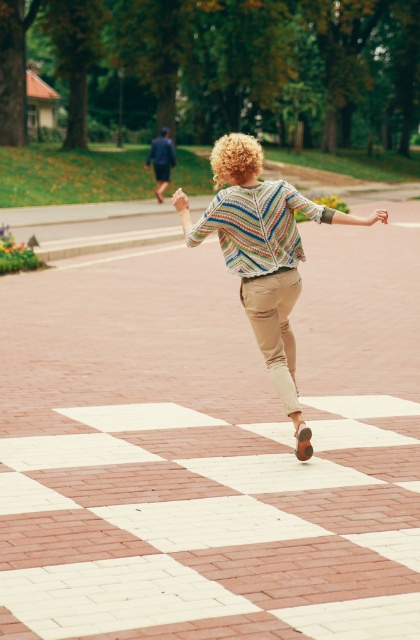
You are standing in the park and see the multicolored knitted sweater at center and the brick pavement at center. Which object is closer to the ground?

The brick pavement at center is closer to the ground because it is below the multicolored knitted sweater at center.

You are a photographer trying to capture the person with curly blonde hair at center and the multicolored knitted sweater at center. Since you want to focus on their clothing, which object should you adjust your camera to focus on more closely?

The multicolored knitted sweater at center is positioned on the right side of curly blonde hair at center, so you should focus on the multicolored knitted sweater at center to capture the clothing details more clearly.